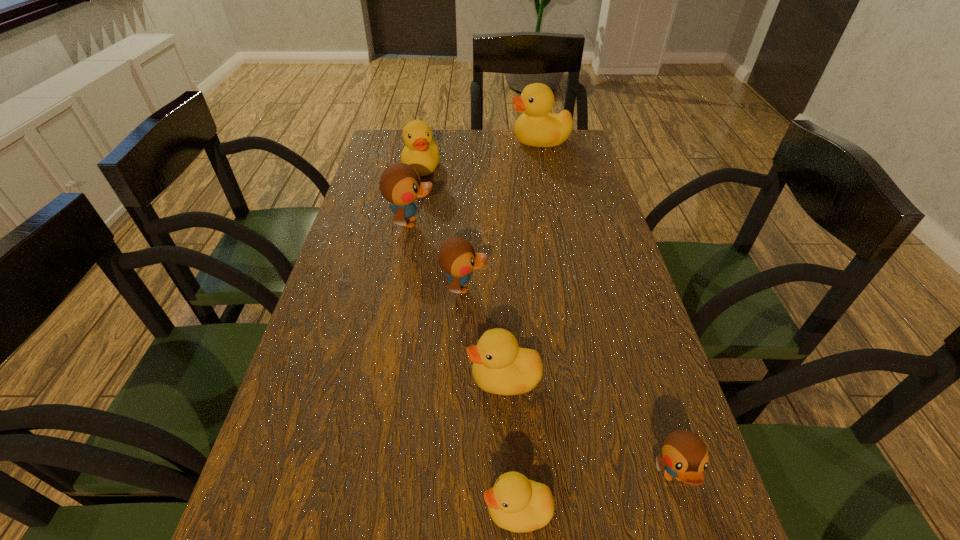
This screenshot has height=540, width=960. Identify the location of the nearest blue duck. (685, 456).

This screenshot has height=540, width=960. In order to click on the smallest blue duck in this screenshot , I will do `click(685, 456)`.

Locate an element on the screen. This screenshot has width=960, height=540. the smallest yellow duck is located at coordinates (515, 503).

Image resolution: width=960 pixels, height=540 pixels. What are the coordinates of `vacant point located 0.190m at the beak of the farthest duck` in the screenshot? It's located at (457, 141).

Locate an element on the screen. vacant area located 0.120m at the beak of the farthest duck is located at coordinates (476, 141).

At what (x,y) coordinates should I click in order to perform the action: click on vacant space situated at the beak of the farthest duck. Please return your answer as a coordinate pair (x, y). Looking at the image, I should click on (398, 141).

At what (x,y) coordinates should I click in order to perform the action: click on free space located 0.110m on the front-facing side of the leftmost blue duck. Please return your answer as a coordinate pair (x, y). Looking at the image, I should click on (475, 222).

Find the location of a particular element. The image size is (960, 540). vacant space located at the beak of the second biggest yellow duck is located at coordinates (409, 239).

You are a GUI agent. You are given a task and a screenshot of the screen. Output one action in this format:
    pyautogui.click(x=<x>, y=<y>)
    Task: Click on the vacant space located 0.320m on the front-facing side of the second blue duck from right to left
    The width and height of the screenshot is (960, 540).
    Given the screenshot: What is the action you would take?
    pyautogui.click(x=621, y=288)

Locate an element on the screen. The width and height of the screenshot is (960, 540). vacant position located at the beak of the second smallest yellow duck is located at coordinates (305, 379).